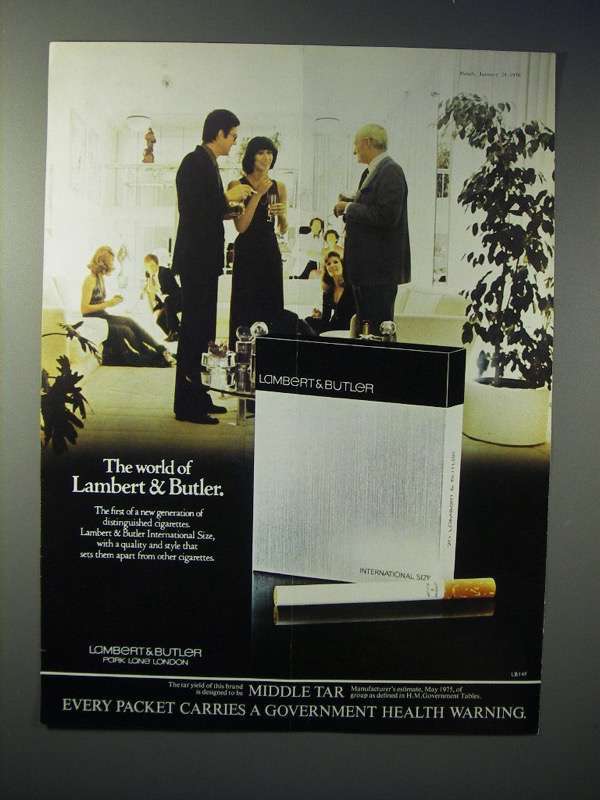
The height and width of the screenshot is (800, 600). In order to click on couch in this screenshot , I will do `click(426, 314)`.